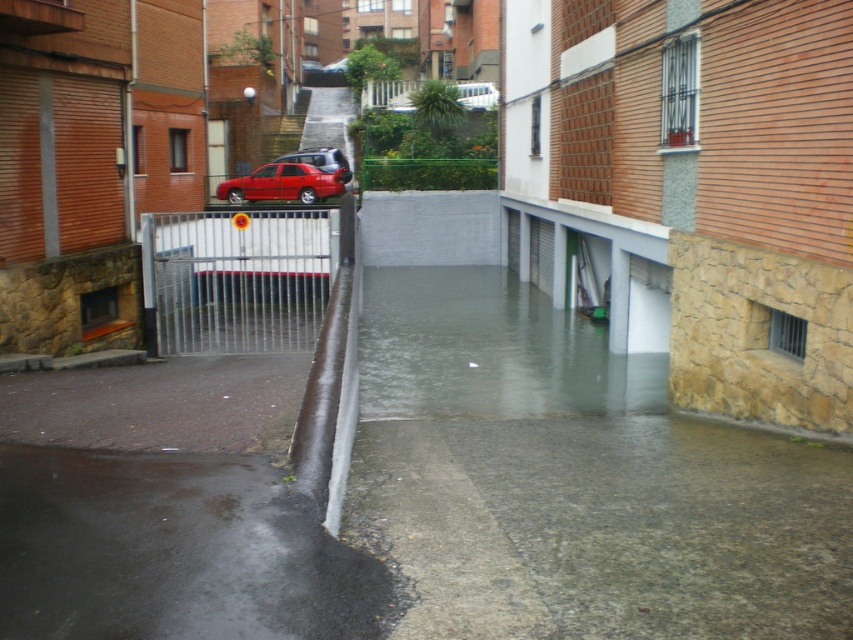
You are a delivery person needing to cross the alley to reach the shiny red car at center. The glossy asphalt puddle at lower left is in your path. Given that the puddle is 24.63 meters away from the car, can you safely walk around it without getting wet?

The glossy asphalt puddle at lower left is 24.63 meters from the shiny red car at center. Since the puddle is at the lower left and the car is at the center, you can walk around the puddle by moving along the right side of the alley to reach the car safely without stepping into the water.

You are a delivery person needing to cross the alley to reach the other side. The alley is flooded, and you see the clear water at lower center and the shiny red car at center. Which object is wider, and how does this affect your path?

The clear water at lower center is wider than the shiny red car at center. Since the water is wider, you should avoid the area where the water is and walk closer to the car to stay on drier ground.

You are a delivery person trying to navigate through the alley. The alley is flooded, and you need to know if the clear water at lower center will block your path to the shiny red car at center. Can you determine if the water is too deep to reach the car?

The clear water at lower center has a larger size compared to the shiny red car at center, which suggests the water covers more area. However, the water level only reaches the base of the alley and the lower part of the gate. Since the shiny red car at center is parked on a sloped driveway, it might be elevated enough to avoid the deepest water. Check the water depth near the car before proceeding.